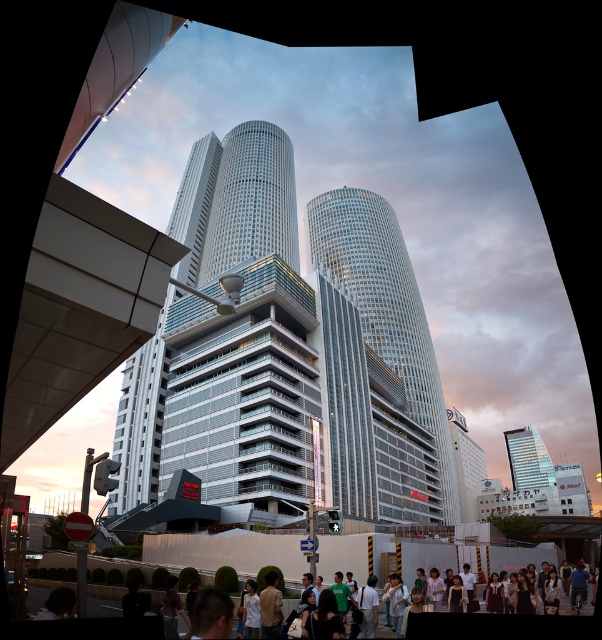
Question: Can you confirm if glassy steel skyscraper at center is positioned below glassy silver skyscraper at center?

Choices:
 (A) yes
 (B) no

Answer: (A)

Question: Among these objects, which one is farthest from the camera?

Choices:
 (A) matte glass skyscraper at center
 (B) glassy steel skyscraper at center
 (C) glassy silver skyscraper at center

Answer: (A)

Question: Does glassy silver skyscraper at center have a larger size compared to matte glass skyscraper at center?

Choices:
 (A) no
 (B) yes

Answer: (B)

Question: Which object appears closest to the camera in this image?

Choices:
 (A) glassy silver skyscraper at center
 (B) glassy steel skyscraper at center

Answer: (B)

Question: Considering the real-world distances, which object is farthest from the glassy silver skyscraper at center?

Choices:
 (A) matte glass skyscraper at center
 (B) glassy steel skyscraper at center

Answer: (A)

Question: Is glassy steel skyscraper at center smaller than matte glass skyscraper at center?

Choices:
 (A) no
 (B) yes

Answer: (A)